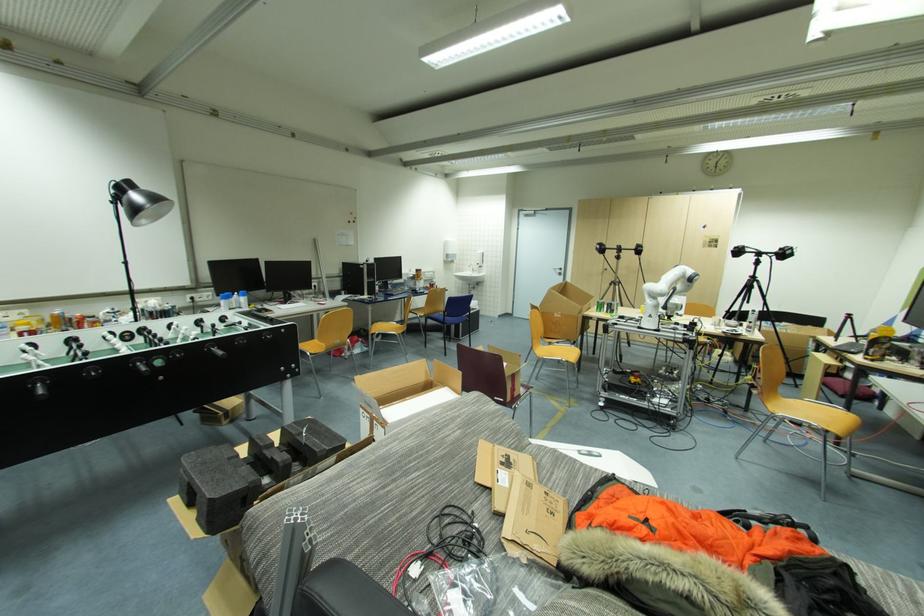
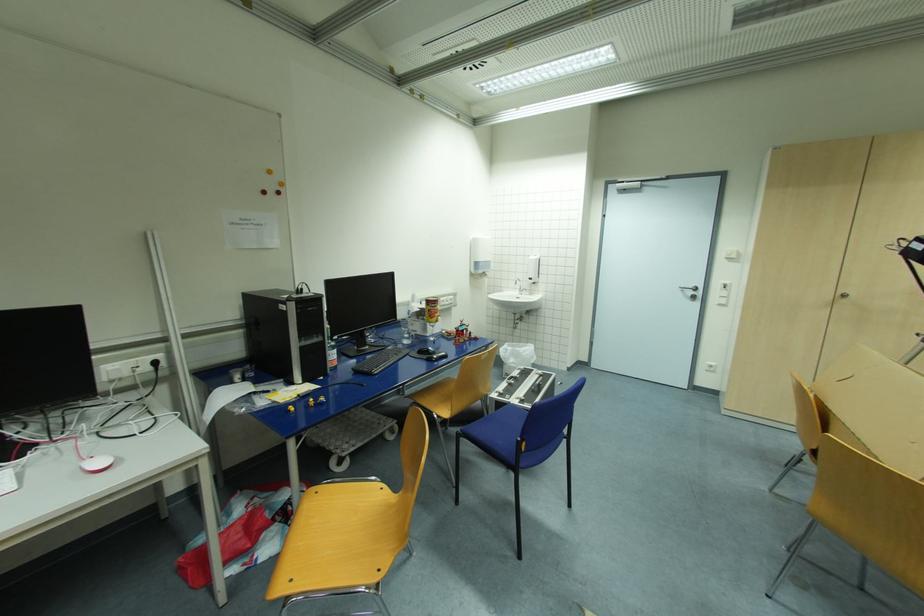
The point at (420, 272) is marked in the first image. Where is the corresponding point in the second image?

(433, 302)